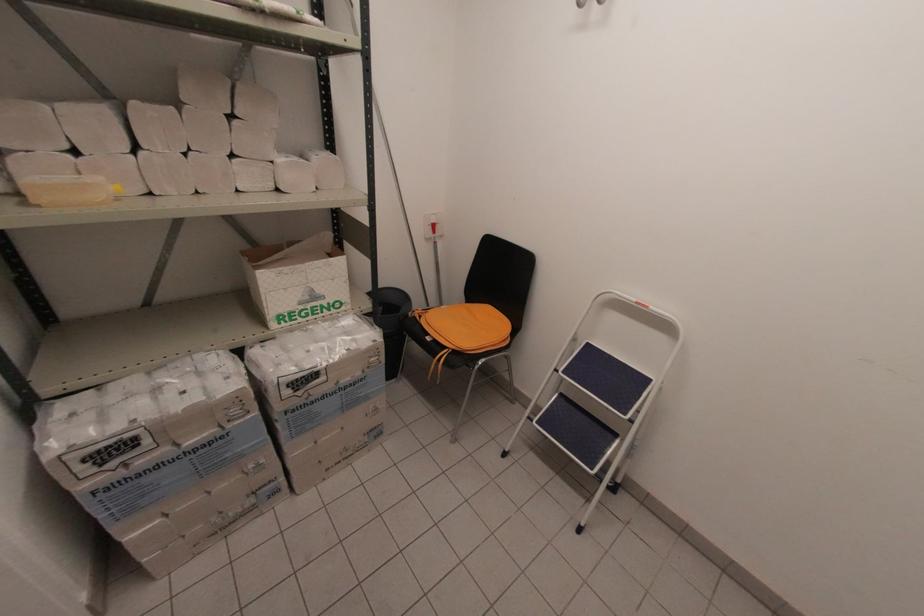
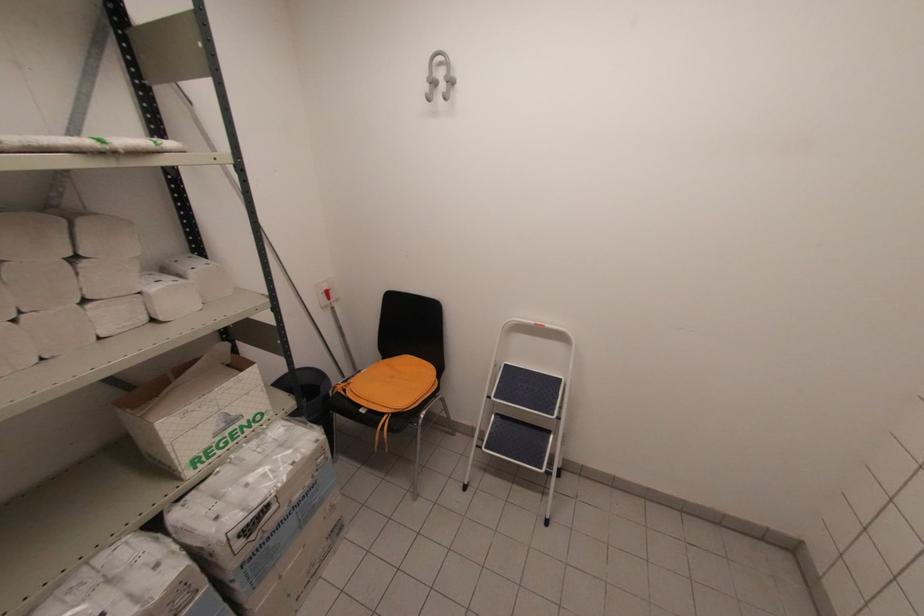
The point at (x=589, y=344) is marked in the first image. Where is the corresponding point in the second image?

(506, 366)